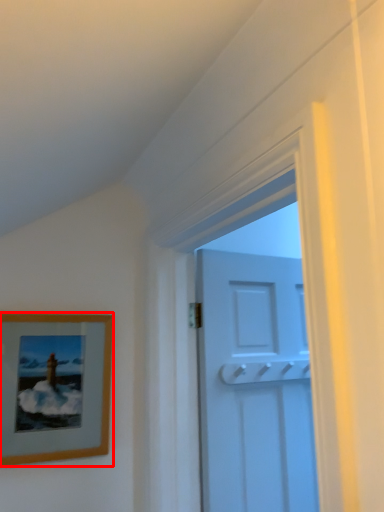
Question: From the image, what is the correct spatial relationship of picture frame (annotated by the red box) in relation to door?

Choices:
 (A) left
 (B) right

Answer: (A)